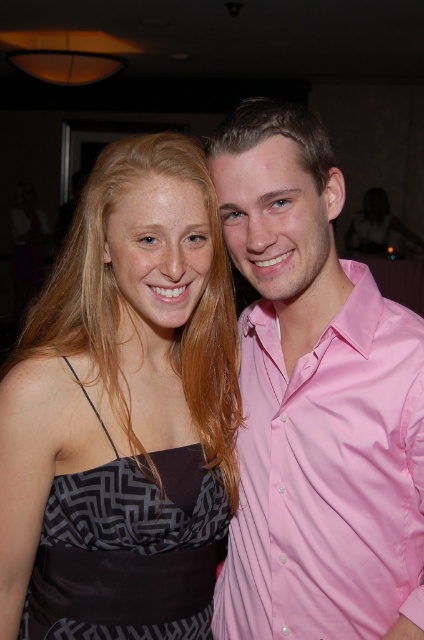
How much distance is there between satin dress at left and pink satin shirt at center?

A distance of 6.63 inches exists between satin dress at left and pink satin shirt at center.

Who is lower down, satin dress at left or pink satin shirt at center?

satin dress at left is below.

Locate an element on the screen. This screenshot has height=640, width=424. satin dress at left is located at coordinates (127, 396).

Can you confirm if satin dress at left is wider than black satin dress at center?

Indeed, satin dress at left has a greater width compared to black satin dress at center.

Which is behind, point (137, 554) or point (119, 618)?

The point (137, 554) is more distant.

Find the location of a particular element. This screenshot has width=424, height=640. satin dress at left is located at coordinates (127, 396).

Does pink satin shirt at center come behind black satin dress at center?

No, pink satin shirt at center is closer to the viewer.

Is pink satin shirt at center below black satin dress at center?

No.

Is point (329, 577) farther from viewer compared to point (144, 467)?

Yes, point (329, 577) is farther from viewer.

Where is `pink satin shirt at center`? This screenshot has height=640, width=424. pink satin shirt at center is located at coordinates (315, 403).